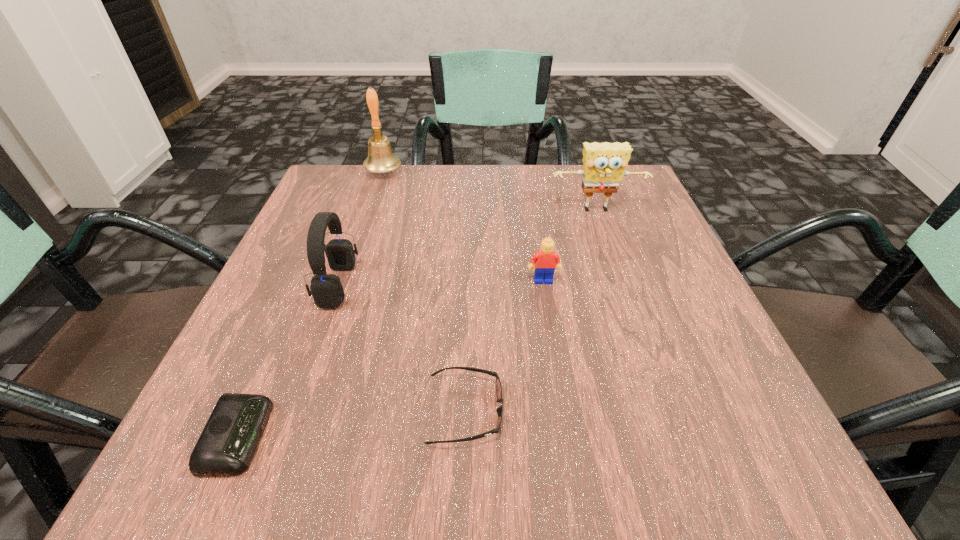
I want to click on vacant space that satisfies the following two spatial constraints: 1. on the front side of the bell; 2. on the headband of the headset, so click(347, 285).

Locate an element on the screen. Image resolution: width=960 pixels, height=540 pixels. vacant position in the image that satisfies the following two spatial constraints: 1. on the face of the fourth tallest object; 2. on the headband of the headset is located at coordinates (544, 285).

Find the location of `free location that satisfies the following two spatial constraints: 1. on the face of the rightmost object; 2. on the headband of the headset`. free location that satisfies the following two spatial constraints: 1. on the face of the rightmost object; 2. on the headband of the headset is located at coordinates 622,285.